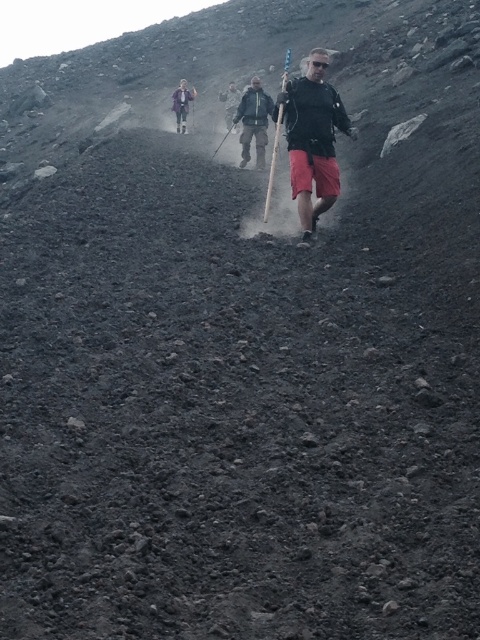
Does matte black jacket at center have a greater width compared to dark gray jacket at center?

Yes, matte black jacket at center is wider than dark gray jacket at center.

Can you confirm if matte black jacket at center is positioned above dark gray jacket at center?

Incorrect, matte black jacket at center is not positioned above dark gray jacket at center.

Is point (322, 74) closer to camera compared to point (264, 113)?

Yes, it is in front of point (264, 113).

Where is `matte black jacket at center`? Image resolution: width=480 pixels, height=640 pixels. matte black jacket at center is located at coordinates (312, 140).

Looking at this image, does dark gray jacket at center appear on the left side of matte gray jacket at upper center?

Incorrect, dark gray jacket at center is not on the left side of matte gray jacket at upper center.

Does point (252, 120) come in front of point (180, 81)?

Yes, point (252, 120) is in front of point (180, 81).

Is point (256, 163) positioned before point (186, 97)?

Yes, point (256, 163) is in front of point (186, 97).

Image resolution: width=480 pixels, height=640 pixels. In order to click on dark gray jacket at center in this screenshot , I will do `click(253, 122)`.

Can you confirm if matte black jacket at center is positioned to the left of matte gray jacket at upper center?

In fact, matte black jacket at center is to the right of matte gray jacket at upper center.

Is matte black jacket at center closer to the viewer compared to matte gray jacket at upper center?

Yes, it is in front of matte gray jacket at upper center.

Between point (321, 140) and point (182, 116), which one is positioned in front?

Point (321, 140) is more forward.

At what (x,y) coordinates should I click in order to perform the action: click on matte black jacket at center. Please return your answer as a coordinate pair (x, y). Looking at the image, I should click on (312, 140).